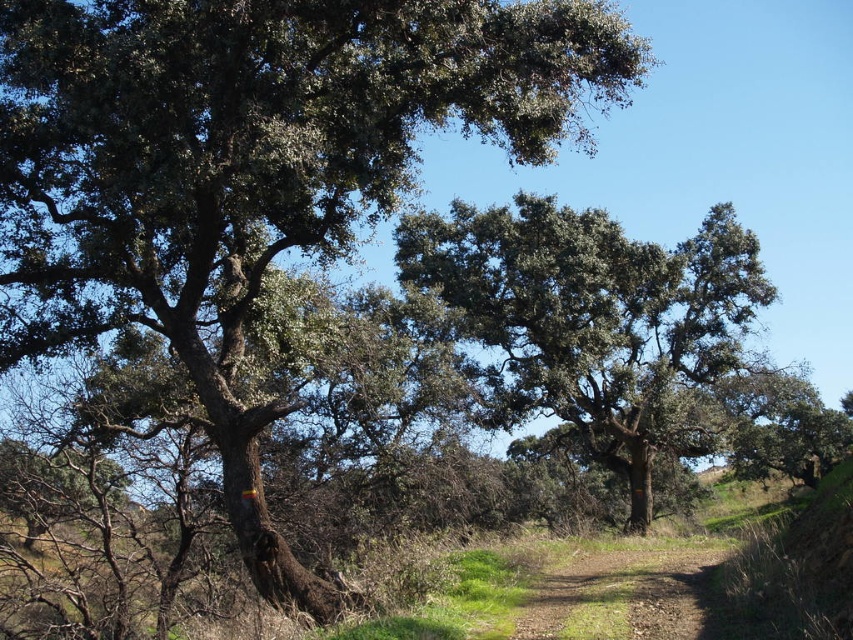
Question: Which object is farther from the camera taking this photo?

Choices:
 (A) green leafy tree at center
 (B) brown dirt track at center

Answer: (A)

Question: Which point is farther from the camera taking this photo?

Choices:
 (A) (611, 620)
 (B) (741, 326)

Answer: (B)

Question: Is green leafy tree at center closer to the viewer compared to brown dirt track at center?

Choices:
 (A) no
 (B) yes

Answer: (A)

Question: Is green leafy tree at center wider than brown dirt track at center?

Choices:
 (A) no
 (B) yes

Answer: (B)

Question: Which point is closer to the camera?

Choices:
 (A) green leafy tree at center
 (B) brown dirt track at center

Answer: (B)

Question: From the image, what is the correct spatial relationship of green leafy tree at center in relation to brown dirt track at center?

Choices:
 (A) left
 (B) right

Answer: (B)